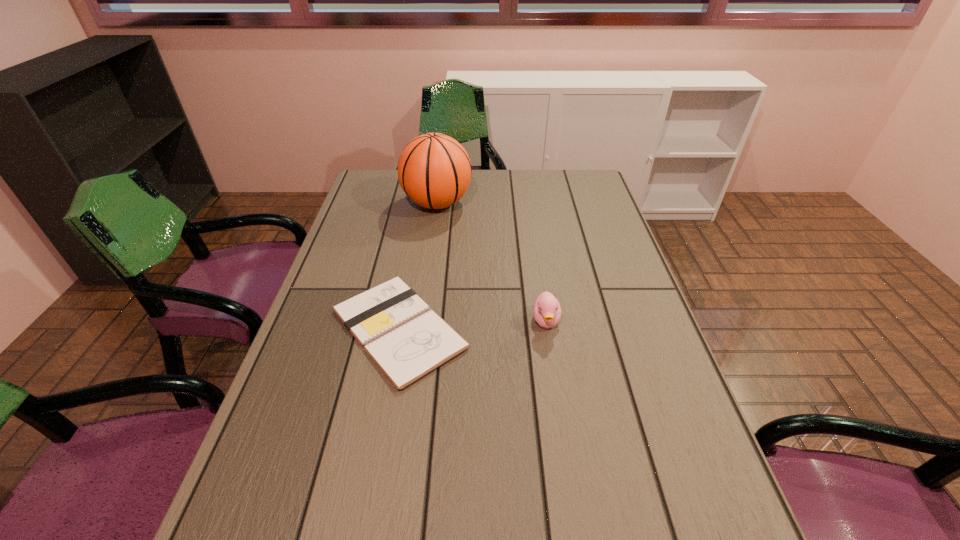
Locate an element on the screen. notepad that is at the left edge is located at coordinates (407, 341).

In order to click on object present at the far left corner in this screenshot , I will do pyautogui.click(x=434, y=170).

In the image, there is a desktop. Where is `free region at the far edge`? Image resolution: width=960 pixels, height=540 pixels. free region at the far edge is located at coordinates (554, 197).

In the image, there is a desktop. Where is `free space at the left edge`? Image resolution: width=960 pixels, height=540 pixels. free space at the left edge is located at coordinates (300, 355).

The width and height of the screenshot is (960, 540). Find the location of `vacant position at the right edge of the desktop`. vacant position at the right edge of the desktop is located at coordinates (620, 397).

I want to click on vacant region at the far left corner of the desktop, so click(380, 172).

Where is `free spot between the second tallest object and the farthest object`? free spot between the second tallest object and the farthest object is located at coordinates (492, 262).

Identify the location of free spot between the notepad and the basketball. The height and width of the screenshot is (540, 960). (419, 266).

Identify the location of empty space that is in between the notepad and the rightmost object. The image size is (960, 540). (472, 325).

In order to click on free spot between the notepad and the tallest object in this screenshot , I will do `click(419, 266)`.